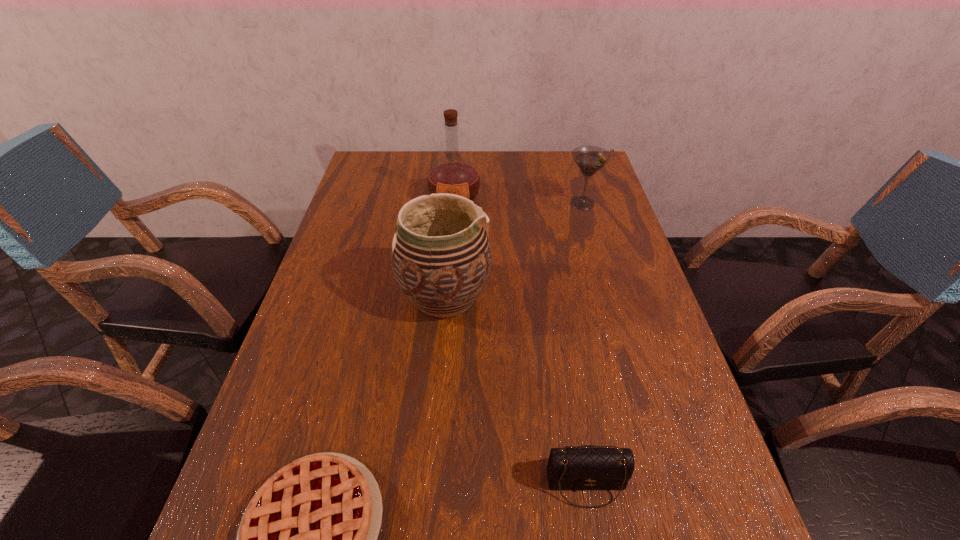
In order to click on liquor in this screenshot , I will do `click(454, 174)`.

In order to click on the third nearest object in this screenshot , I will do `click(441, 257)`.

Find the location of a particular element. The height and width of the screenshot is (540, 960). the rightmost object is located at coordinates (590, 159).

I want to click on the third tallest object, so click(x=590, y=159).

Find the location of a particular element. Image resolution: width=960 pixels, height=540 pixels. the fourth object from left to right is located at coordinates (587, 467).

The width and height of the screenshot is (960, 540). Identify the location of the fourth tallest object. (587, 467).

This screenshot has width=960, height=540. Identify the location of free space located 0.050m on the front label of the liquor. (453, 225).

You are a GUI agent. You are given a task and a screenshot of the screen. Output one action in this format:
    pyautogui.click(x=<x>, y=<y>)
    Task: Click on the free region located 0.180m on the back of the pottery
    The image size is (960, 540).
    Given the screenshot: What is the action you would take?
    pos(450,225)

Identify the location of vacant space located 0.360m on the front of the rightmost object. The width and height of the screenshot is (960, 540). (611, 300).

Where is `object located in the far edge section of the desktop`? object located in the far edge section of the desktop is located at coordinates [x=454, y=174].